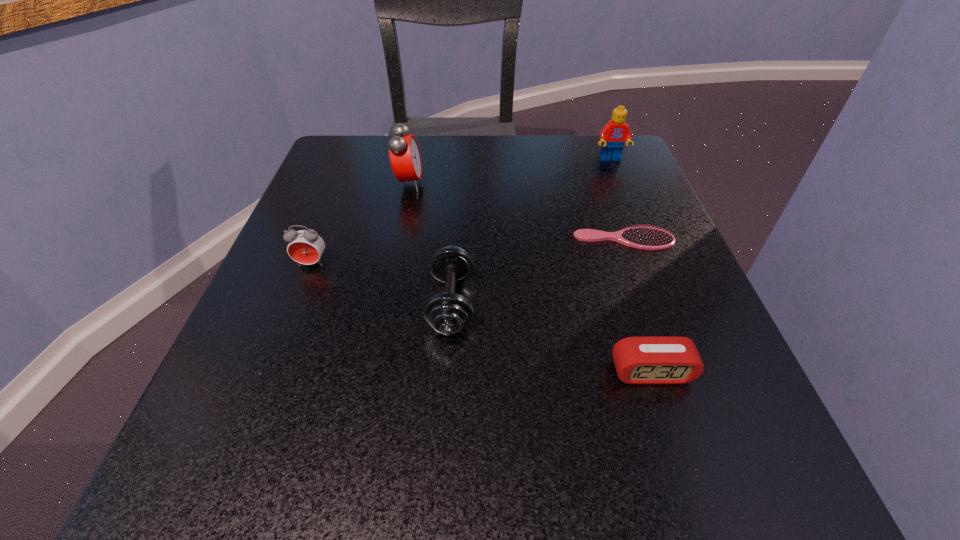
Locate an element on the screen. The width and height of the screenshot is (960, 540). free spot that satisfies the following two spatial constraints: 1. on the front-facing side of the shortest object; 2. on the right side of the second object from left to right is located at coordinates (397, 240).

This screenshot has height=540, width=960. What are the coordinates of `free region that satisfies the following two spatial constraints: 1. on the front-facing side of the second alarm clock from left to right; 2. on the left side of the fourth nearest object` in the screenshot? It's located at (397, 240).

I want to click on vacant area that satisfies the following two spatial constraints: 1. on the front-facing side of the second object from left to right; 2. on the left side of the shortest object, so click(397, 240).